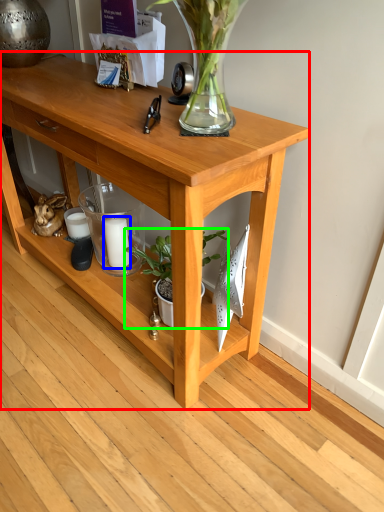
Question: Which is farther away from table (highlighted by a red box)? candle (highlighted by a blue box) or houseplant (highlighted by a green box)?

Choices:
 (A) candle
 (B) houseplant

Answer: (A)